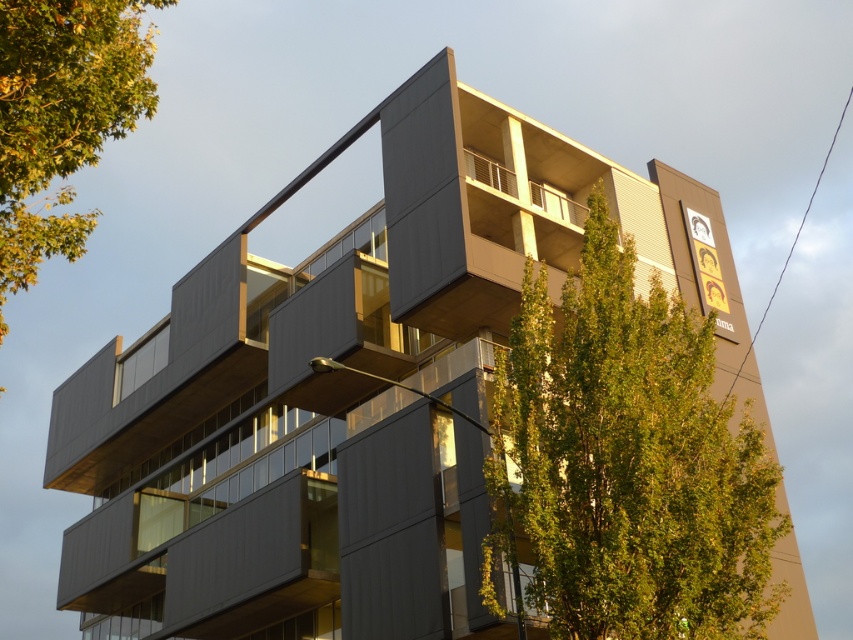
Is the position of green leafy tree at upper center less distant than that of green leafy tree at upper left?

No, it is behind green leafy tree at upper left.

Does point (552, 376) lie behind point (47, 173)?

Yes, point (552, 376) is farther from viewer.

Image resolution: width=853 pixels, height=640 pixels. In order to click on green leafy tree at upper center in this screenshot , I will do `click(625, 461)`.